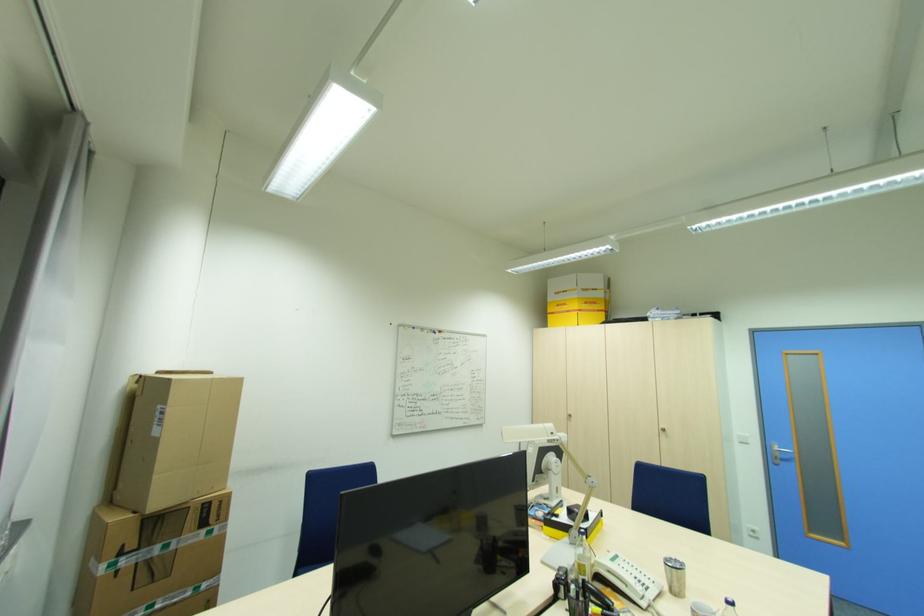
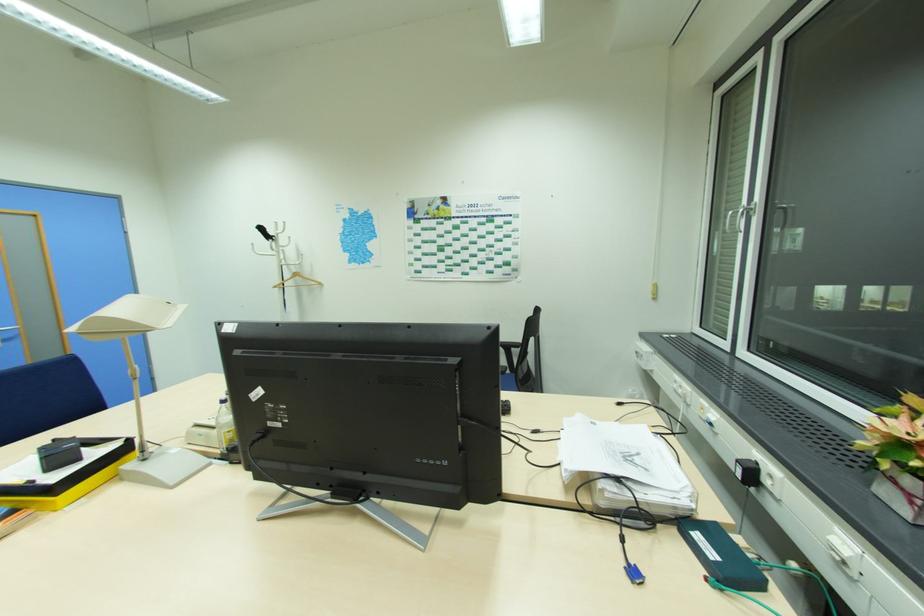
Locate, in the second image, the point that corresponds to [788,456] in the first image.

(11, 337)